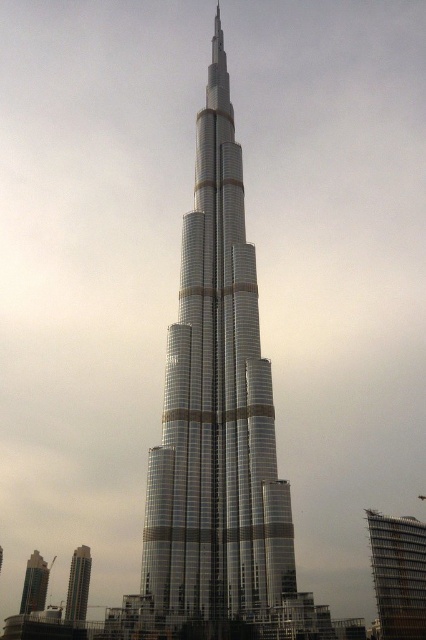
Question: Can you confirm if glassy metallic skyscraper at center is positioned to the left of silver metallic building at lower left?

Choices:
 (A) no
 (B) yes

Answer: (A)

Question: Which of the following is the closest to the observer?

Choices:
 (A) (215, 474)
 (B) (86, 568)
 (C) (34, 577)
 (D) (416, 557)

Answer: (D)

Question: Is glassy steel skyscraper at center bigger than silver metallic building at lower left?

Choices:
 (A) yes
 (B) no

Answer: (A)

Question: Considering the relative positions of glassy metallic skyscraper at center and metallic glass skyscraper at lower left in the image provided, where is glassy metallic skyscraper at center located with respect to metallic glass skyscraper at lower left?

Choices:
 (A) below
 (B) above

Answer: (B)

Question: Which point is farther from the camera taking this photo?

Choices:
 (A) (28, 600)
 (B) (77, 596)
 (C) (157, 611)

Answer: (A)

Question: Which is nearer to the glassy metallic skyscraper at center?

Choices:
 (A) glassy steel skyscraper at center
 (B) silver metallic building at lower left
 (C) metallic glass skyscraper at lower left

Answer: (A)